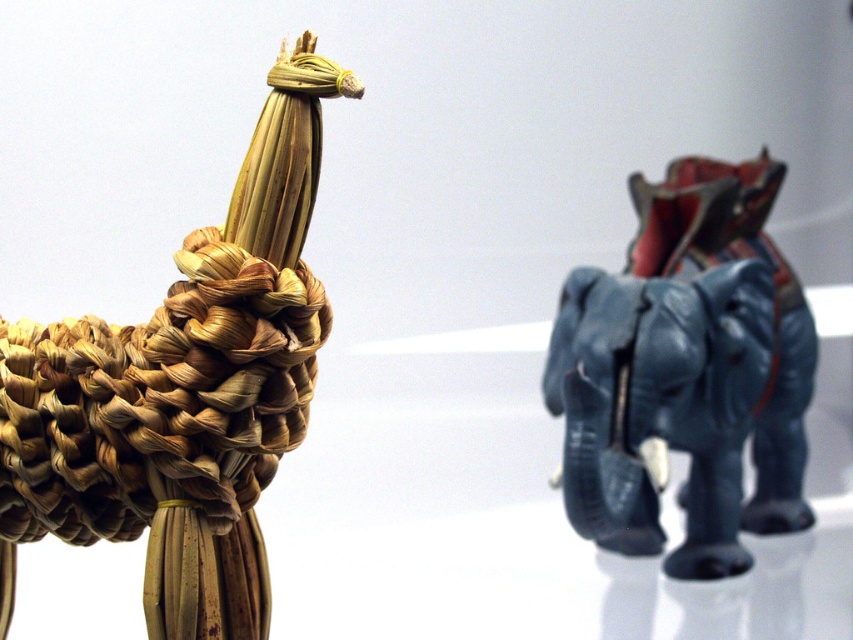
Question: From the image, what is the correct spatial relationship of braided straw elephant at center in relation to matte blue elephant at right?

Choices:
 (A) right
 (B) left

Answer: (B)

Question: Does braided straw elephant at center have a smaller size compared to matte blue elephant at right?

Choices:
 (A) no
 (B) yes

Answer: (A)

Question: Which of the following is the farthest from the observer?

Choices:
 (A) matte blue elephant at right
 (B) braided straw elephant at center

Answer: (A)

Question: Which object is closer to the camera taking this photo?

Choices:
 (A) matte blue elephant at right
 (B) braided straw elephant at center

Answer: (B)

Question: Among these points, which one is nearest to the camera?

Choices:
 (A) (68, 352)
 (B) (575, 314)

Answer: (A)

Question: Considering the relative positions of braided straw elephant at center and matte blue elephant at right in the image provided, where is braided straw elephant at center located with respect to matte blue elephant at right?

Choices:
 (A) right
 (B) left

Answer: (B)